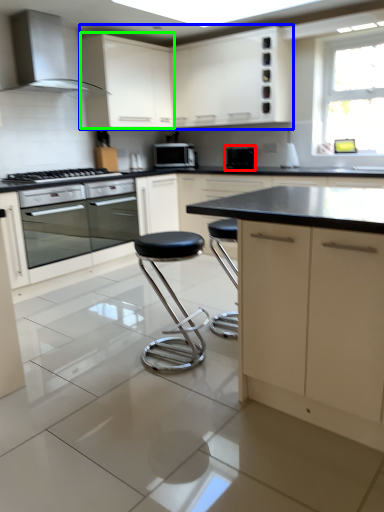
Question: Estimate the real-world distances between objects in this image. Which object is farther from appliance (highlighted by a red box), cabinetry (highlighted by a blue box) or cabinetry (highlighted by a green box)?

Choices:
 (A) cabinetry
 (B) cabinetry

Answer: (B)